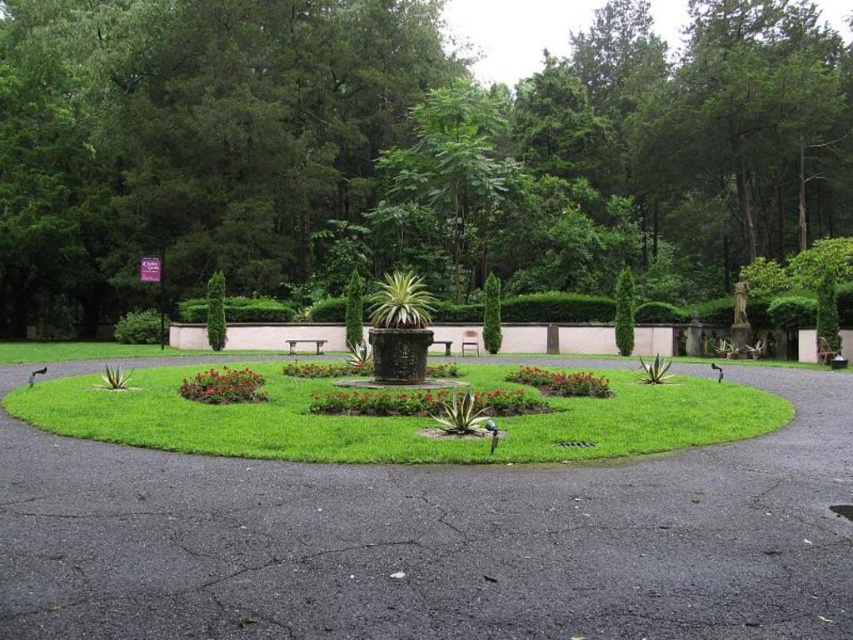
Consider the image. You are a gardener trying to place a new decorative stone statue that is 1.2 meters wide. You have two options for placement in the garden scene described. The first option is on the gray asphalt at center, and the second option is on the green textured bush at center. Based on the spatial information provided, which location would allow the statue to fit without overcrowding the area?

The gray asphalt at center might be wider than green textured bush at center, so placing the statue on the gray asphalt at center would likely provide enough space since it is wider than the green textured bush at center.